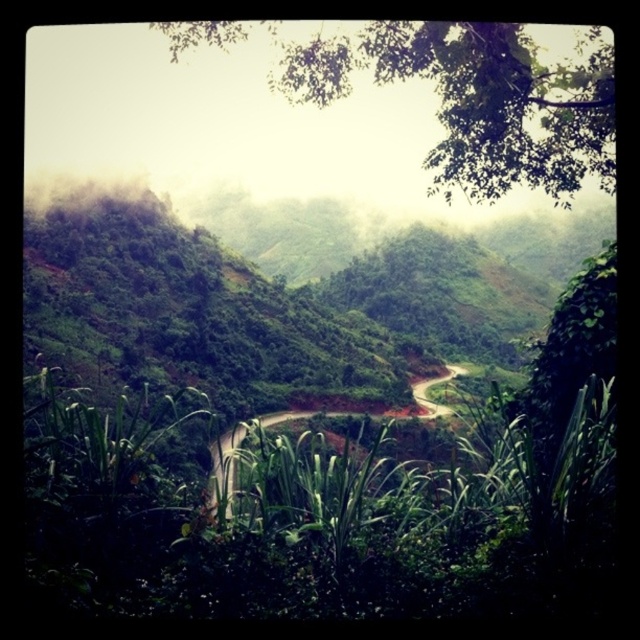
Question: Is green leafy tree at upper center to the left of dirt road at center from the viewer's perspective?

Choices:
 (A) no
 (B) yes

Answer: (A)

Question: Which point is farther to the camera?

Choices:
 (A) (488, 193)
 (B) (212, 492)

Answer: (B)

Question: Is green leafy tree at upper center closer to the viewer compared to dirt road at center?

Choices:
 (A) no
 (B) yes

Answer: (A)

Question: Which point is closer to the camera?

Choices:
 (A) dirt road at center
 (B) green leafy tree at upper center

Answer: (A)

Question: Is green leafy tree at upper center further to the viewer compared to dirt road at center?

Choices:
 (A) yes
 (B) no

Answer: (A)